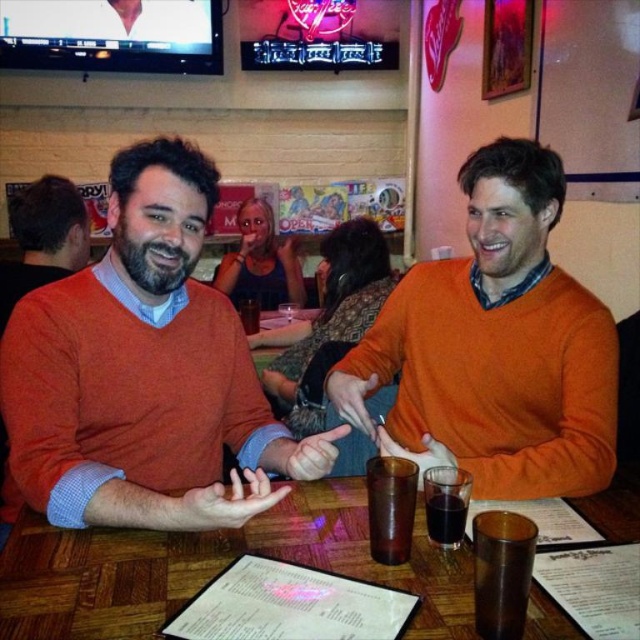
Question: Does matte orange sweater at left lie behind orange matte sweater at center?

Choices:
 (A) yes
 (B) no

Answer: (B)

Question: Does wooden table at center have a smaller size compared to translucent plastic cup at center?

Choices:
 (A) no
 (B) yes

Answer: (A)

Question: Which of the following is the farthest from the observer?

Choices:
 (A) orange matte sweater at center
 (B) wooden table at center
 (C) translucent glass at center
 (D) dark brown liquid at table center

Answer: (C)

Question: Which point is closer to the camera taking this photo?

Choices:
 (A) (211, 301)
 (B) (486, 404)
 (C) (252, 330)

Answer: (A)

Question: Does wooden table at center have a smaller size compared to translucent plastic cup at center?

Choices:
 (A) no
 (B) yes

Answer: (A)

Question: Among these points, which one is farthest from the camera?

Choices:
 (A) tap(452, 304)
 (B) tap(140, 332)

Answer: (A)